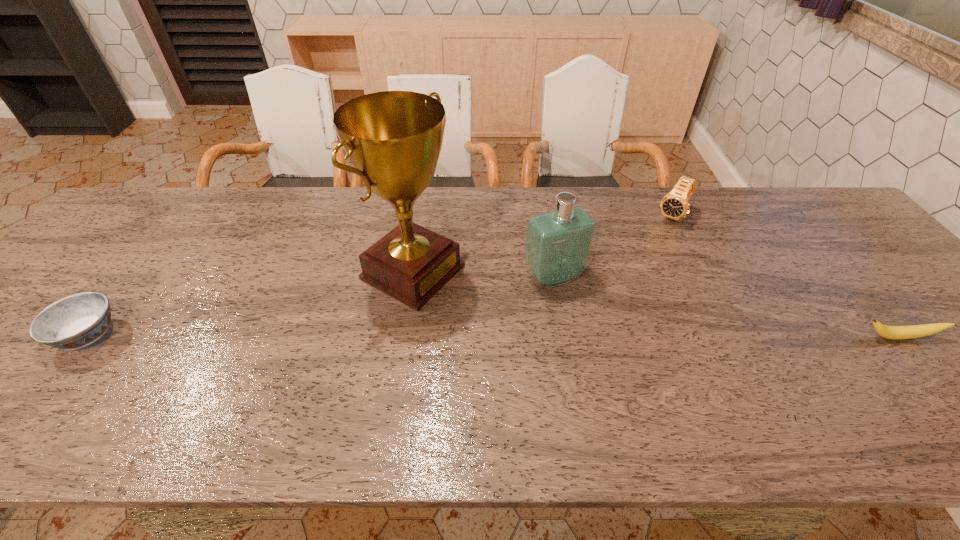
Find the location of a particular element. This screenshot has width=960, height=540. object located in the left edge section of the desktop is located at coordinates (76, 321).

This screenshot has width=960, height=540. What are the coordinates of `object located at the right edge` in the screenshot? It's located at (914, 331).

In the image, there is a desktop. Find the location of `vacant space at the far edge`. vacant space at the far edge is located at coordinates point(669,189).

Image resolution: width=960 pixels, height=540 pixels. What are the coordinates of `vacant area at the near edge` in the screenshot? It's located at (558, 384).

At what (x,y) coordinates should I click in order to perform the action: click on free region at the right edge of the desktop. Please return your answer as a coordinate pair (x, y). The image size is (960, 540). Looking at the image, I should click on (876, 259).

In the image, there is a desktop. At what (x,y) coordinates should I click in order to perform the action: click on vacant space at the far left corner. Please return your answer as a coordinate pair (x, y). Image resolution: width=960 pixels, height=540 pixels. Looking at the image, I should click on (144, 230).

Where is `vacant area that lies between the farthest object and the perfume`? This screenshot has width=960, height=540. vacant area that lies between the farthest object and the perfume is located at coordinates (612, 246).

I want to click on unoccupied position between the ashtray and the banana, so click(493, 336).

Locate an element on the screen. This screenshot has width=960, height=540. vacant space in between the award and the fourth shortest object is located at coordinates 483,274.

Where is `empty space that is in between the rightmost object and the leftmost object`? empty space that is in between the rightmost object and the leftmost object is located at coordinates (493, 336).